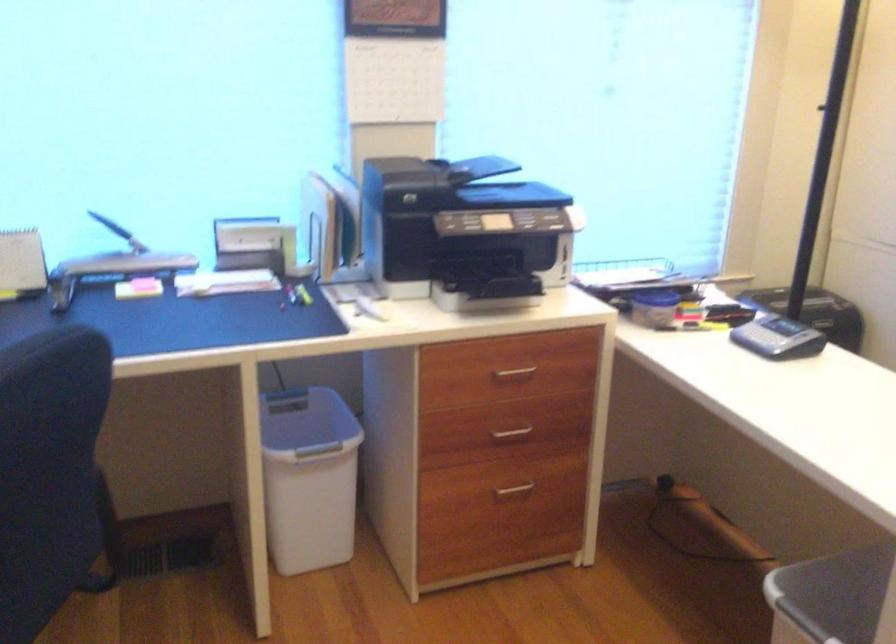
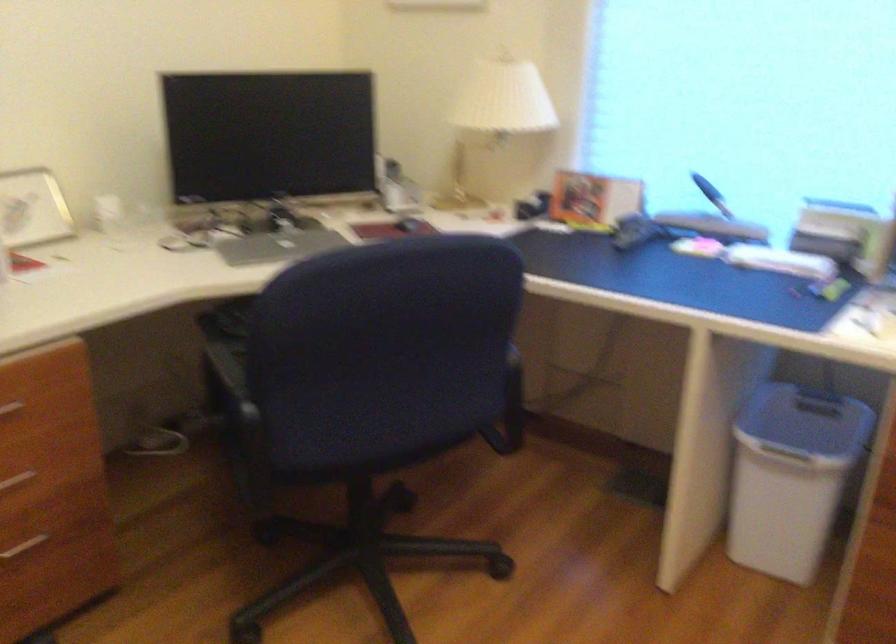
Question: The images are taken continuously from a first-person perspective. In which direction is your viewpoint rotating?

Choices:
 (A) Left
 (B) Right
 (C) Up
 (D) Down

Answer: (A)